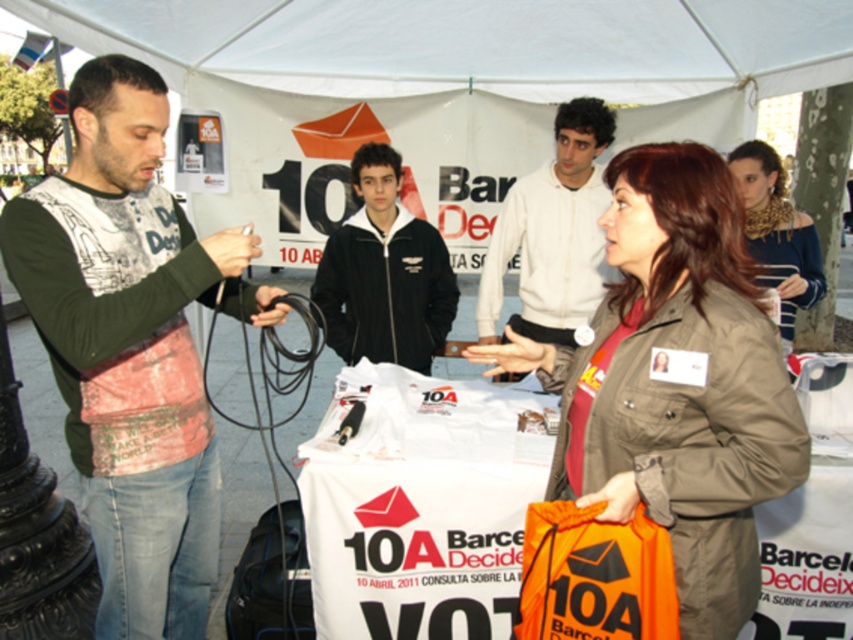
Question: Which object is the closest to the white cotton shirt at upper center?

Choices:
 (A) green cotton shirt at left
 (B) leopard print scarf at upper right

Answer: (B)

Question: Can you confirm if green cotton shirt at left is positioned to the left of matte khaki jacket at center?

Choices:
 (A) no
 (B) yes

Answer: (B)

Question: Is white cotton shirt at upper center thinner than leopard print scarf at upper right?

Choices:
 (A) yes
 (B) no

Answer: (B)

Question: Which object is closer to the camera taking this photo?

Choices:
 (A) leopard print scarf at upper right
 (B) green cotton shirt at left
 (C) matte khaki jacket at center
 (D) black fleece jacket at center

Answer: (C)

Question: Among these objects, which one is farthest from the camera?

Choices:
 (A) matte khaki jacket at center
 (B) white cotton shirt at upper center
 (C) green cotton shirt at left

Answer: (B)

Question: Does matte khaki jacket at center appear under black fleece jacket at center?

Choices:
 (A) yes
 (B) no

Answer: (A)